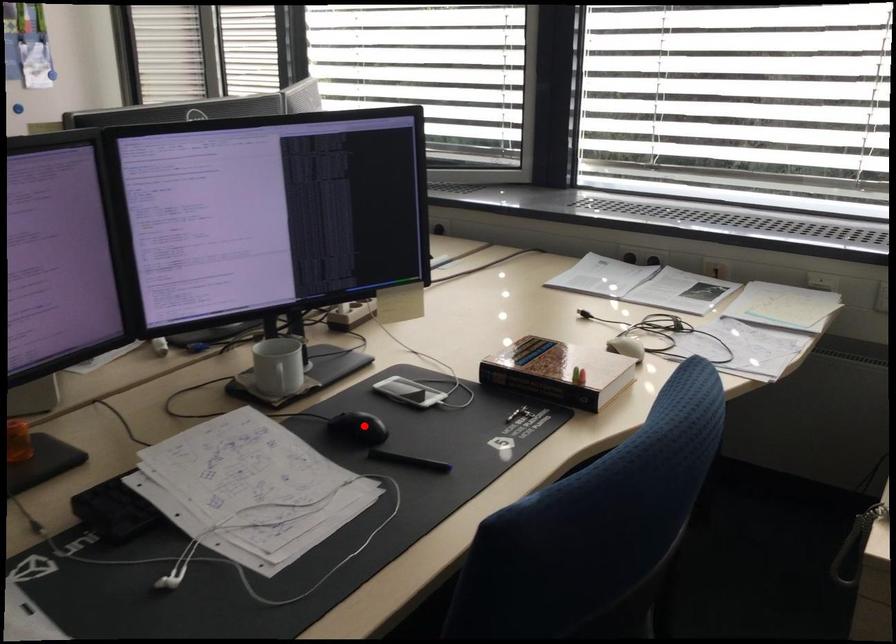
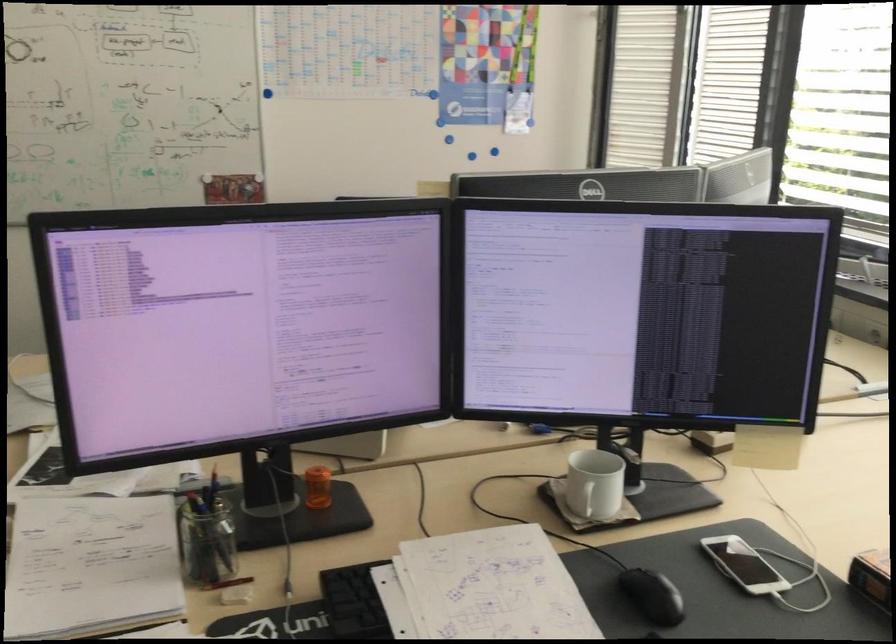
Question: I am providing you with two images of the same scene from different viewpoints. In image1, a red point is highlighted. Considering the same 3D point in image2, which of the following is correct?

Choices:
 (A) It is closer
 (B) It is farther

Answer: (A)